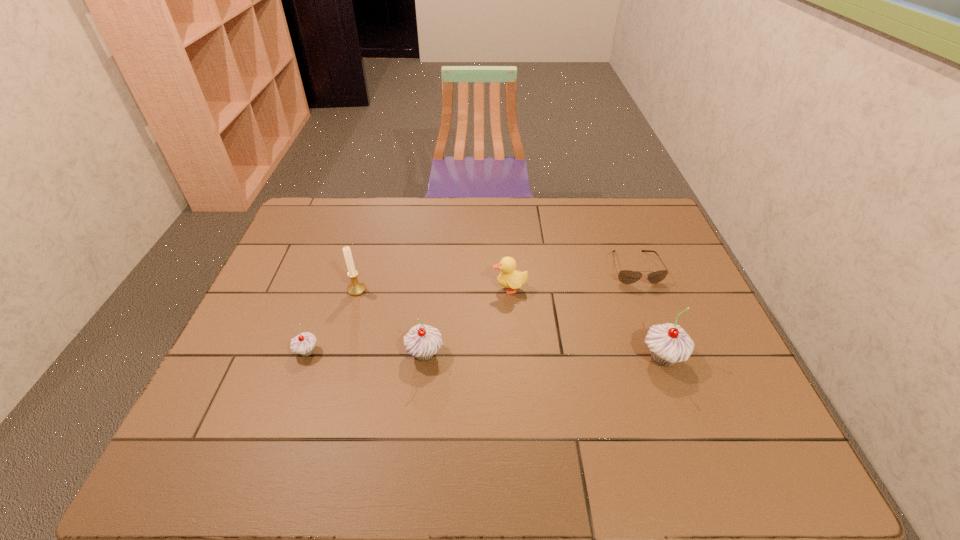
This screenshot has width=960, height=540. Find the location of `the shortest cupcake`. the shortest cupcake is located at coordinates (303, 344).

Image resolution: width=960 pixels, height=540 pixels. I want to click on the leftmost cupcake, so click(303, 344).

The width and height of the screenshot is (960, 540). What are the coordinates of `the second shortest cupcake` in the screenshot? It's located at (422, 341).

This screenshot has width=960, height=540. What are the coordinates of `the third object from left to right` in the screenshot? It's located at (422, 341).

Where is `the rightmost cupcake`? This screenshot has height=540, width=960. the rightmost cupcake is located at coordinates (668, 343).

I want to click on duckling, so click(x=509, y=277).

At what (x,y) coordinates should I click in order to perform the action: click on sunglasses. Please return your answer as a coordinate pair (x, y). The height and width of the screenshot is (540, 960). Looking at the image, I should click on (625, 276).

Locate an element on the screen. Image resolution: width=960 pixels, height=540 pixels. candle holder is located at coordinates (355, 288).

Find the location of a particular element. This screenshot has width=960, height=540. vacant space located 0.160m on the front of the leftmost cupcake is located at coordinates (283, 420).

Locate an element on the screen. vacant region located on the left of the second cupcake from left to right is located at coordinates (327, 354).